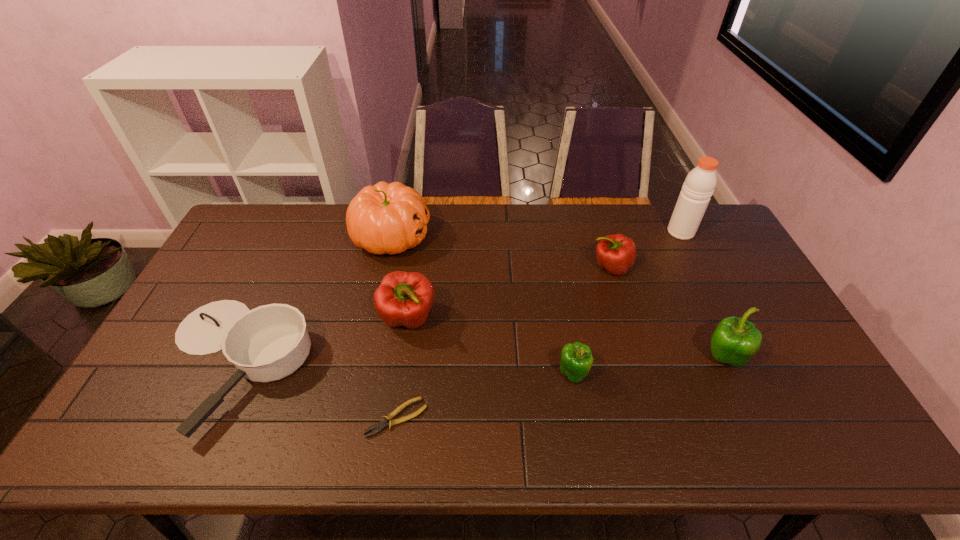
Find the location of a particular element. The width and height of the screenshot is (960, 540). empty space that is in between the second bell pepper from left to right and the yellow pliers is located at coordinates (485, 396).

Find the location of a particular element. vacant space that's between the smaller pink bell pepper and the pumpkin is located at coordinates (501, 252).

What are the coordinates of `blank region between the smaller green bell pepper and the nearer pink bell pepper` in the screenshot? It's located at (491, 346).

Find the location of `free spot between the tallest object and the second shortest object`. free spot between the tallest object and the second shortest object is located at coordinates (457, 298).

Locate an element on the screen. Image resolution: width=960 pixels, height=540 pixels. vacant space in between the smaller pink bell pepper and the bigger green bell pepper is located at coordinates (666, 313).

Where is `the seventh closest object to the third object from right to left`? Image resolution: width=960 pixels, height=540 pixels. the seventh closest object to the third object from right to left is located at coordinates (270, 342).

Identify which object is the fifth closest to the leftmost bell pepper. Please provide its 2D coordinates. Your answer should be formatted as a tuple, i.e. [(x, y)], where the tuple contains the x and y coordinates of a point satisfying the conditions above.

[(616, 253)]

At what (x,y) coordinates should I click in order to perform the action: click on bell pepper that is the third closest to the second bell pepper from right to left. Please return your answer as a coordinate pair (x, y). This screenshot has height=540, width=960. Looking at the image, I should click on (403, 298).

Identify which bell pepper is the second nearest to the left green bell pepper. Please provide its 2D coordinates. Your answer should be formatted as a tuple, i.e. [(x, y)], where the tuple contains the x and y coordinates of a point satisfying the conditions above.

[(735, 340)]

Image resolution: width=960 pixels, height=540 pixels. I want to click on vacant space that satisfies the following two spatial constraints: 1. on the carved face of the fourth object from right to left; 2. on the right side of the pumpkin, so click(x=361, y=374).